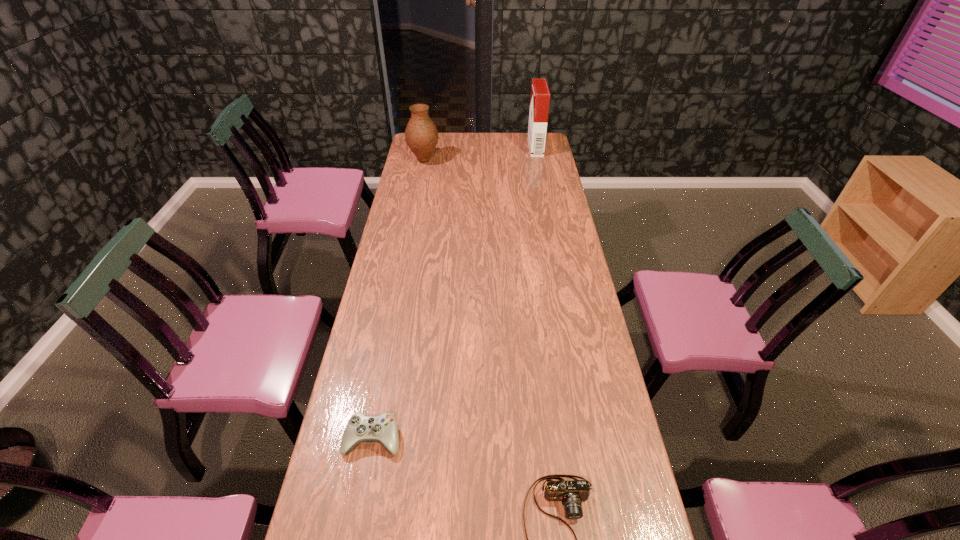
The width and height of the screenshot is (960, 540). Find the location of `cigarette_case`. cigarette_case is located at coordinates (540, 96).

At what (x,y) coordinates should I click in order to perform the action: click on the second tallest object. Please return your answer as a coordinate pair (x, y). The width and height of the screenshot is (960, 540). Looking at the image, I should click on (421, 134).

Find the location of a particular element. control is located at coordinates (382, 429).

This screenshot has width=960, height=540. Identify the location of vacant space located 0.350m on the front-facing side of the cigarette_case. (467, 147).

Locate an element on the screen. The width and height of the screenshot is (960, 540). vacant point located on the front-facing side of the cigarette_case is located at coordinates (472, 147).

Where is `vacant position located 0.090m on the front-facing side of the cigarette_case`? This screenshot has width=960, height=540. vacant position located 0.090m on the front-facing side of the cigarette_case is located at coordinates (513, 147).

At what (x,y) coordinates should I click in order to perform the action: click on vacant region located on the back of the vase. Please return your answer as a coordinate pair (x, y). Looking at the image, I should click on (429, 135).

Image resolution: width=960 pixels, height=540 pixels. What are the coordinates of `vacant region located on the back of the control` in the screenshot? It's located at (382, 390).

Find the location of a particular element. This screenshot has height=540, width=960. object present at the far edge is located at coordinates (540, 96).

The width and height of the screenshot is (960, 540). Find the location of `vase located in the left edge section of the desktop`. vase located in the left edge section of the desktop is located at coordinates click(421, 134).